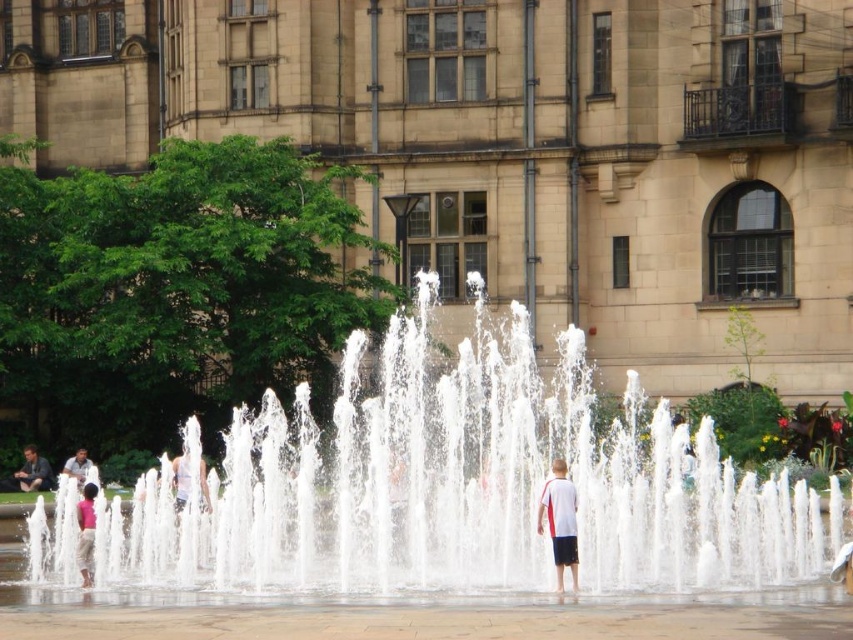
Between white water at center and pink fabric at center, which one is positioned lower?

pink fabric at center is below.

Measure the distance between white water at center and camera.

white water at center is 50.54 meters away from camera.

Identify the location of white water at center. (462, 486).

Does white water at center appear on the left side of white cotton shirt at center?

Indeed, white water at center is positioned on the left side of white cotton shirt at center.

Who is shorter, white water at center or white cotton shirt at center?

white cotton shirt at center is shorter.

Which is behind, point (726, 532) or point (569, 486)?

Positioned behind is point (726, 532).

Find the location of a particular element. This screenshot has height=640, width=853. white water at center is located at coordinates (462, 486).

Between pink fabric at center and light blue shirt at center, which one has more height?

With more height is pink fabric at center.

Who is positioned more to the left, pink fabric at center or light blue shirt at center?

light blue shirt at center

Where is `pink fabric at center`? The image size is (853, 640). pink fabric at center is located at coordinates (86, 532).

I want to click on pink fabric at center, so click(x=86, y=532).